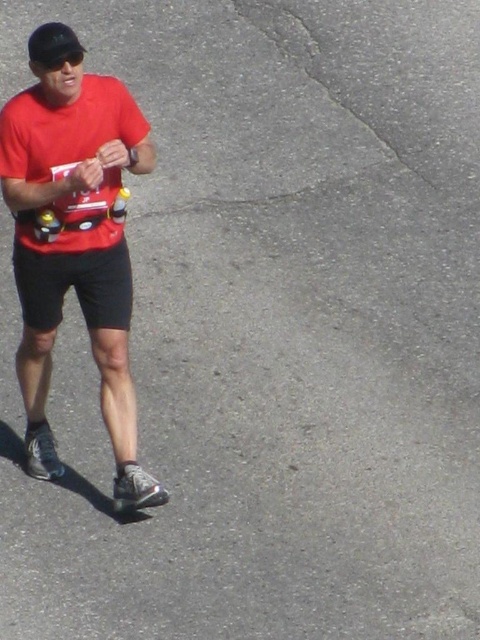
Looking at this image, you are a photographer trying to capture the runner in the image. You need to focus your camera on the matte red shirt at left and the black cotton shorts at center. Which object should you adjust your focus to first if you want to ensure both are in focus, considering their sizes?

The matte red shirt at left is larger in size than the black cotton shorts at center. To ensure both are in focus, you should first focus on the larger matte red shirt at left since it requires more detailed focus due to its size, then adjust for the smaller black cotton shorts at center.

You are a photographer at a marathon event. You need to take a photo of the runner wearing a matte red shirt at left and black cotton shorts at center. Based on their positions, which clothing item is more to the right?

The matte red shirt at left is positioned on the right side of black cotton shorts at center, so the matte red shirt at left is more to the right.

You are a photographer standing at the camera position. You want to take a photo of the runner. The point where you want to focus is at point (72, 188). Is this point within the recommended focusing range of 10 feet for your camera?

The point (72, 188) is 15.49 feet away from the camera, which exceeds the recommended focusing range of 10 feet. Therefore, the camera may not focus properly on this point.